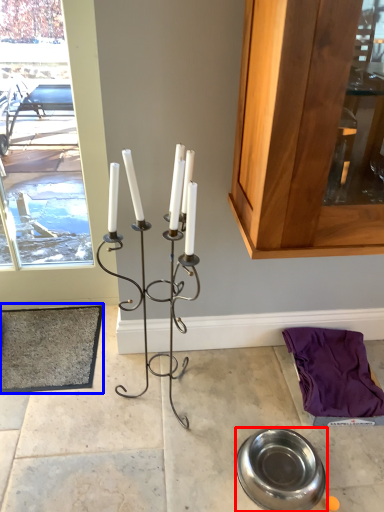
Question: Which of the following is the farthest to the observer, tableware (highlighted by a red box) or doormat (highlighted by a blue box)?

Choices:
 (A) tableware
 (B) doormat

Answer: (B)